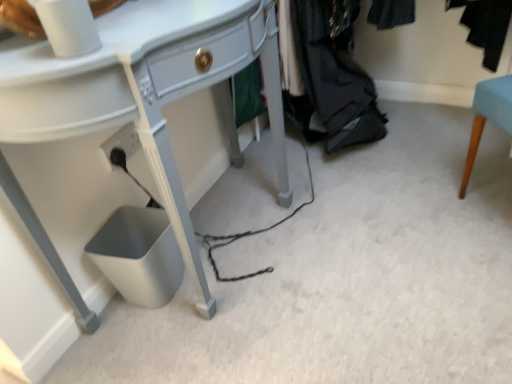
Question: Based on their sizes in the image, would you say matte white desk at center is bigger or smaller than dark gray fabric at lower right?

Choices:
 (A) big
 (B) small

Answer: (A)

Question: From the image's perspective, is matte white desk at center located above or below dark gray fabric at lower right?

Choices:
 (A) below
 (B) above

Answer: (A)

Question: Is matte white desk at center taller or shorter than dark gray fabric at lower right?

Choices:
 (A) short
 (B) tall

Answer: (B)

Question: Considering the positions of dark gray fabric at lower right and matte white desk at center in the image, is dark gray fabric at lower right taller or shorter than matte white desk at center?

Choices:
 (A) tall
 (B) short

Answer: (B)

Question: Is point (298, 44) closer or farther from the camera than point (53, 314)?

Choices:
 (A) closer
 (B) farther

Answer: (B)

Question: In the image, is dark gray fabric at lower right on the left side or the right side of matte white desk at center?

Choices:
 (A) left
 (B) right

Answer: (B)

Question: From a real-world perspective, relative to matte white desk at center, is dark gray fabric at lower right vertically above or below?

Choices:
 (A) below
 (B) above

Answer: (A)